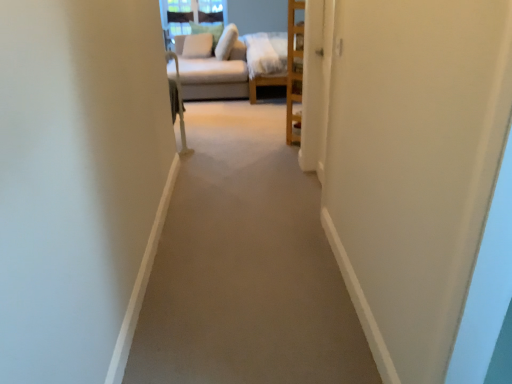
Question: Is carpet at center beside white soft pillow at upper center, placed as the third pillow when sorted from left to right?

Choices:
 (A) no
 (B) yes

Answer: (A)

Question: Is carpet at center not within white soft pillow at upper center, placed as the third pillow when sorted from left to right?

Choices:
 (A) no
 (B) yes

Answer: (B)

Question: Is carpet at center oriented away from white soft pillow at upper center, placed as the third pillow when sorted from left to right?

Choices:
 (A) no
 (B) yes

Answer: (A)

Question: From a real-world perspective, is carpet at center below white soft pillow at upper center, placed as the third pillow when sorted from left to right?

Choices:
 (A) no
 (B) yes

Answer: (B)

Question: Is the depth of carpet at center less than that of white soft pillow at upper center, which is the 1th pillow from right to left?

Choices:
 (A) no
 (B) yes

Answer: (B)

Question: Is white soft pillow at upper center, the 3th pillow viewed from the right, inside the boundaries of light beige fabric pillow at upper center, the second pillow viewed from the left, or outside?

Choices:
 (A) inside
 (B) outside

Answer: (A)

Question: Does point click(201, 41) appear closer or farther from the camera than point click(214, 26)?

Choices:
 (A) closer
 (B) farther

Answer: (A)

Question: Based on their sizes in the image, would you say white soft pillow at upper center, the 3th pillow viewed from the right, is bigger or smaller than light beige fabric pillow at upper center, which ranks as the second pillow in right-to-left order?

Choices:
 (A) big
 (B) small

Answer: (B)

Question: From the image's perspective, is white soft pillow at upper center, the 3th pillow viewed from the right, positioned above or below light beige fabric pillow at upper center, the second pillow viewed from the left?

Choices:
 (A) above
 (B) below

Answer: (B)

Question: Would you say beige fabric couch at upper center is inside or outside white soft pillow at upper center, the 3th pillow viewed from the right?

Choices:
 (A) outside
 (B) inside

Answer: (A)

Question: From the image's perspective, is beige fabric couch at upper center located above or below white soft pillow at upper center, the 3th pillow viewed from the right?

Choices:
 (A) below
 (B) above

Answer: (A)

Question: Is beige fabric couch at upper center bigger or smaller than white soft pillow at upper center, the 1th pillow from the left?

Choices:
 (A) small
 (B) big

Answer: (B)

Question: From their relative heights in the image, would you say beige fabric couch at upper center is taller or shorter than white soft pillow at upper center, the 1th pillow from the left?

Choices:
 (A) tall
 (B) short

Answer: (A)

Question: Visually, is carpet at center positioned to the left or to the right of light beige fabric pillow at upper center, which ranks as the second pillow in right-to-left order?

Choices:
 (A) right
 (B) left

Answer: (A)

Question: From a real-world perspective, is carpet at center physically located above or below light beige fabric pillow at upper center, the second pillow viewed from the left?

Choices:
 (A) below
 (B) above

Answer: (A)